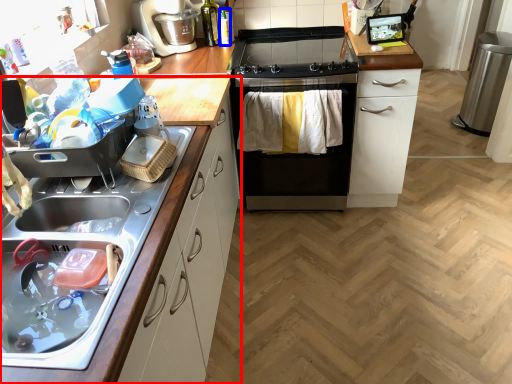
Question: Which object appears closest to the camera in this image, cabinetry (highlighted by a red box) or bottle (highlighted by a blue box)?

Choices:
 (A) cabinetry
 (B) bottle

Answer: (A)